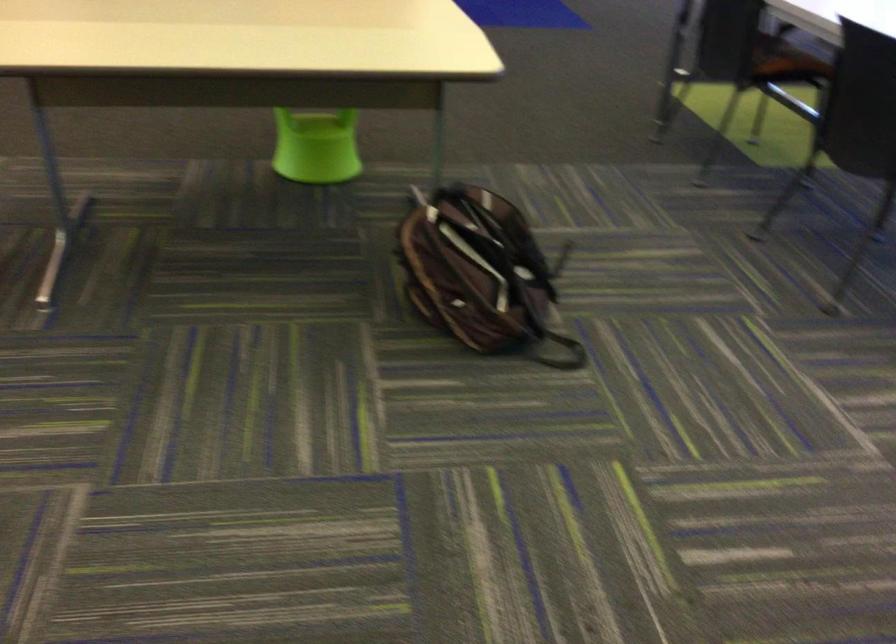
Describe the element at coordinates (761, 43) in the screenshot. The image size is (896, 644). I see `a chair sitting surface` at that location.